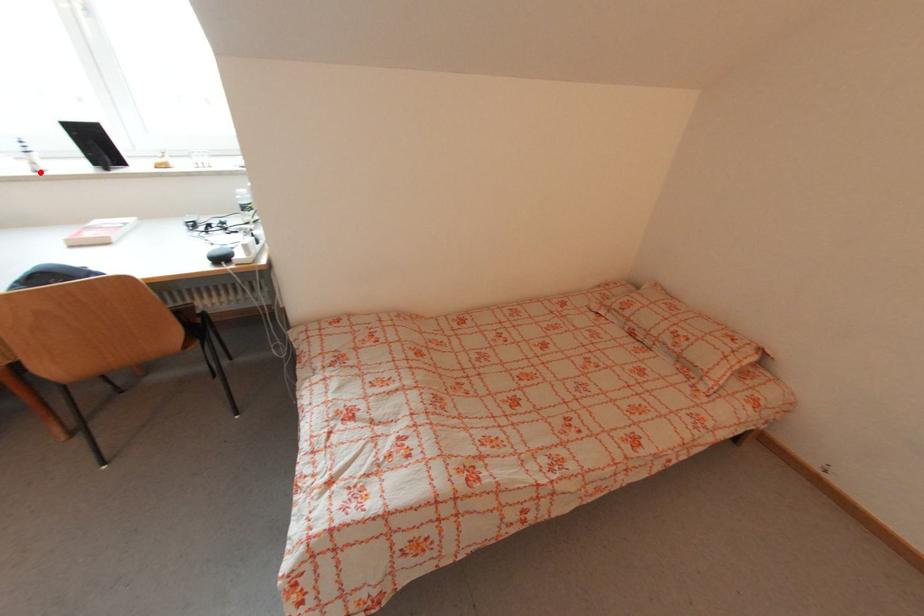
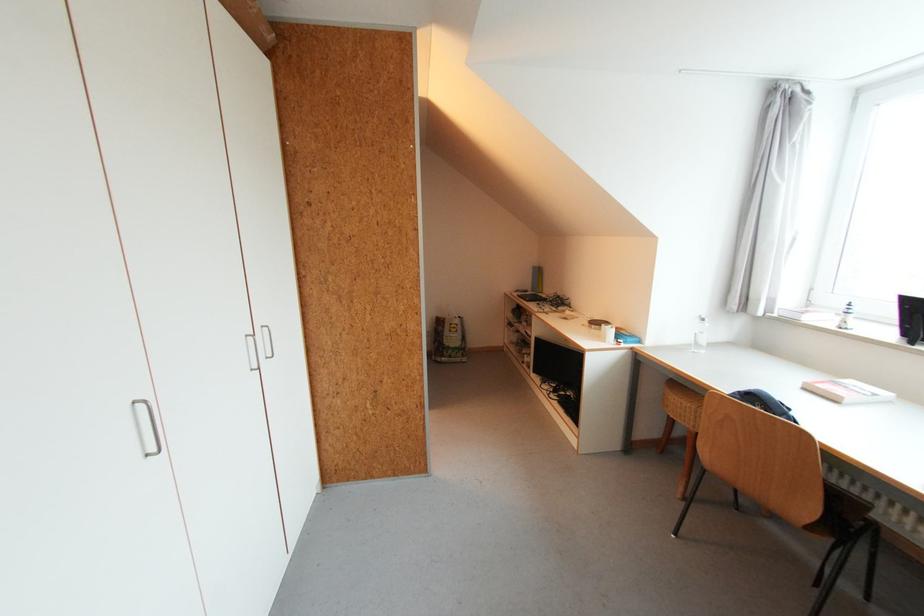
Locate, in the second image, the point that corresponds to the highlighted location in the first image.

(845, 329)